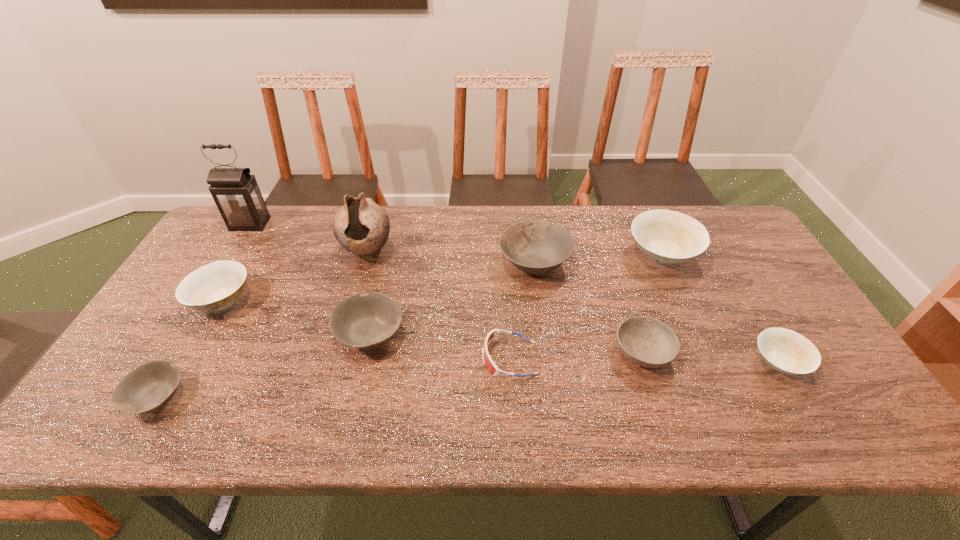
Locate an element on the screen. The height and width of the screenshot is (540, 960). the ninth closest object to the nearest beige bowl is located at coordinates (236, 193).

Where is `object that is the third nearest to the second gray bowl from right to left`? This screenshot has width=960, height=540. object that is the third nearest to the second gray bowl from right to left is located at coordinates (216, 286).

The height and width of the screenshot is (540, 960). What are the coordinates of `bowl object that ranks as the fifth closest to the pottery` in the screenshot? It's located at (645, 341).

Where is `bowl that is the second nearest to the smallest gray bowl`? This screenshot has height=540, width=960. bowl that is the second nearest to the smallest gray bowl is located at coordinates (367, 319).

Choose which beige bowl is the nearest neighbor to the nearest gray bowl. Please provide its 2D coordinates. Your answer should be formatted as a tuple, i.e. [(x, y)], where the tuple contains the x and y coordinates of a point satisfying the conditions above.

[(216, 286)]

Find the location of a particular element. the closest beige bowl to the nearest beige bowl is located at coordinates (668, 237).

Locate an element on the screen. gray bowl that is the third closest to the nearest beige bowl is located at coordinates (146, 388).

Locate an element on the screen. The width and height of the screenshot is (960, 540). the closest gray bowl to the biggest gray bowl is located at coordinates (367, 319).

In order to click on vacant space that satisfies the following two spatial constraints: 1. on the front-facing side of the red goggles; 2. on the right side of the smallest beige bowl in this screenshot , I will do `click(510, 362)`.

I want to click on vacant region that satisfies the following two spatial constraints: 1. on the front-facing side of the tallest object; 2. on the right side of the biggest beige bowl, so click(231, 254).